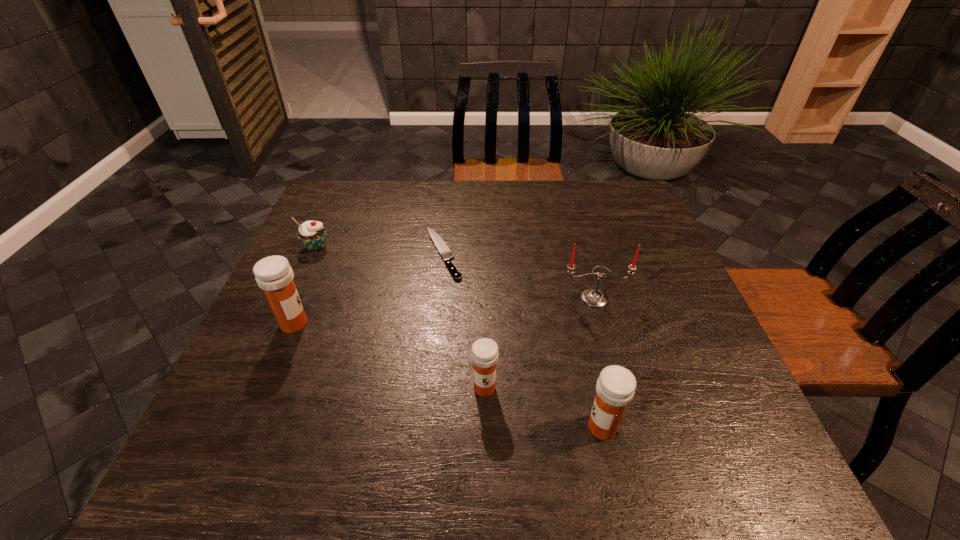
Locate an element on the screen. vacant space that's between the nearest object and the leftmost medicine is located at coordinates (448, 375).

The width and height of the screenshot is (960, 540). Identify the location of free spot between the second shortest medicine and the second nearest object. (543, 408).

I want to click on object that is the second closest to the second shortest medicine, so click(593, 297).

The width and height of the screenshot is (960, 540). I want to click on the third closest object relative to the second medicine from left to right, so click(445, 252).

Where is `medicine that stands as the closest to the third nearest object`? The width and height of the screenshot is (960, 540). medicine that stands as the closest to the third nearest object is located at coordinates (484, 353).

Identify the location of medicine identified as the second closest to the farthest medicine. This screenshot has height=540, width=960. (615, 387).

Where is `vacant space that satisfies the following two spatial constraints: 1. on the front side of the third object from left to right; 2. on the label side of the leftmost medicine`? The height and width of the screenshot is (540, 960). vacant space that satisfies the following two spatial constraints: 1. on the front side of the third object from left to right; 2. on the label side of the leftmost medicine is located at coordinates (437, 323).

Find the location of a particular element. The image size is (960, 540). vacant area that satisfies the following two spatial constraints: 1. on the front-facing side of the third farthest object; 2. on the label side of the leftmost medicine is located at coordinates (602, 323).